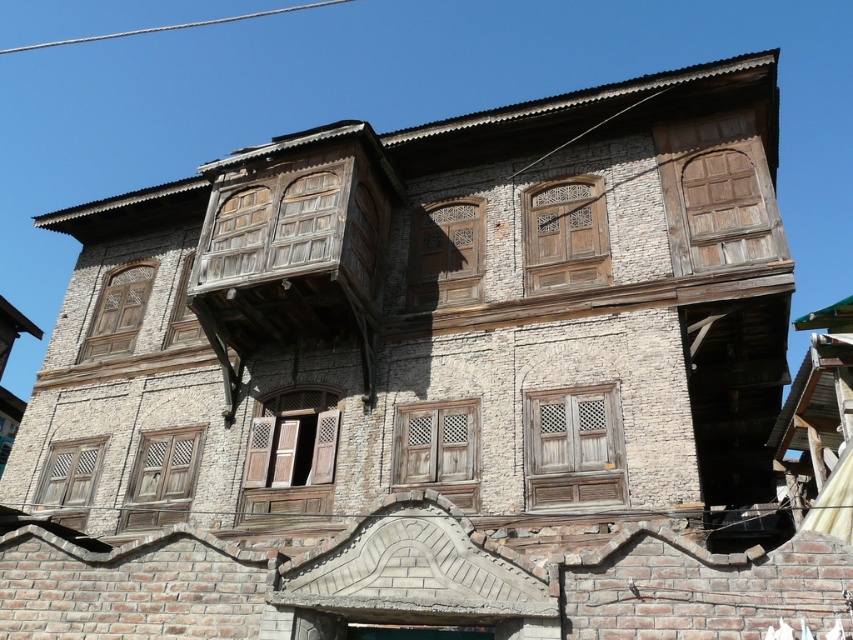
Is wooden at upper right closer to camera compared to weathered wood window at center?

No, wooden at upper right is further to the viewer.

Based on the photo, who is lower down, wooden at upper right or weathered wood window at center?

weathered wood window at center is lower down.

The height and width of the screenshot is (640, 853). What do you see at coordinates (717, 193) in the screenshot?
I see `wooden at upper right` at bounding box center [717, 193].

Where is `wooden at upper right`? This screenshot has height=640, width=853. wooden at upper right is located at coordinates (717, 193).

This screenshot has width=853, height=640. In order to click on wooden lattice window at upper left in this screenshot , I will do `click(119, 310)`.

Who is positioned more to the right, wooden lattice window at upper left or wooden lattice window at lower left?

wooden lattice window at upper left

Between point (119, 307) and point (96, 468), which one is positioned in front?

Point (96, 468) is more forward.

The width and height of the screenshot is (853, 640). In order to click on wooden lattice window at upper left in this screenshot , I will do `click(119, 310)`.

Which is in front, point (740, 236) or point (544, 230)?

Positioned in front is point (740, 236).

Measure the distance from wooden at upper right to wooden carved door at center.

wooden at upper right is 5.34 feet away from wooden carved door at center.

Is point (689, 260) closer to viewer compared to point (566, 205)?

Yes, point (689, 260) is in front of point (566, 205).

The width and height of the screenshot is (853, 640). I want to click on wooden at upper right, so click(717, 193).